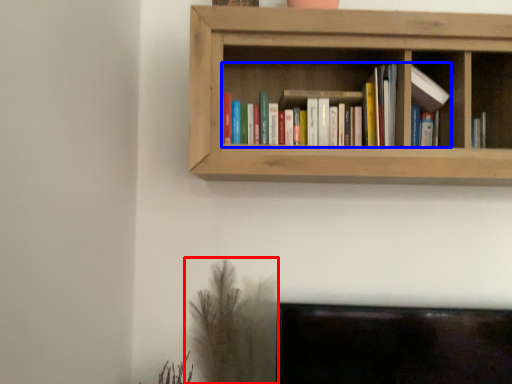
Question: Which point is closer to the camera, plant (highlighted by a red box) or book (highlighted by a blue box)?

Choices:
 (A) plant
 (B) book

Answer: (B)